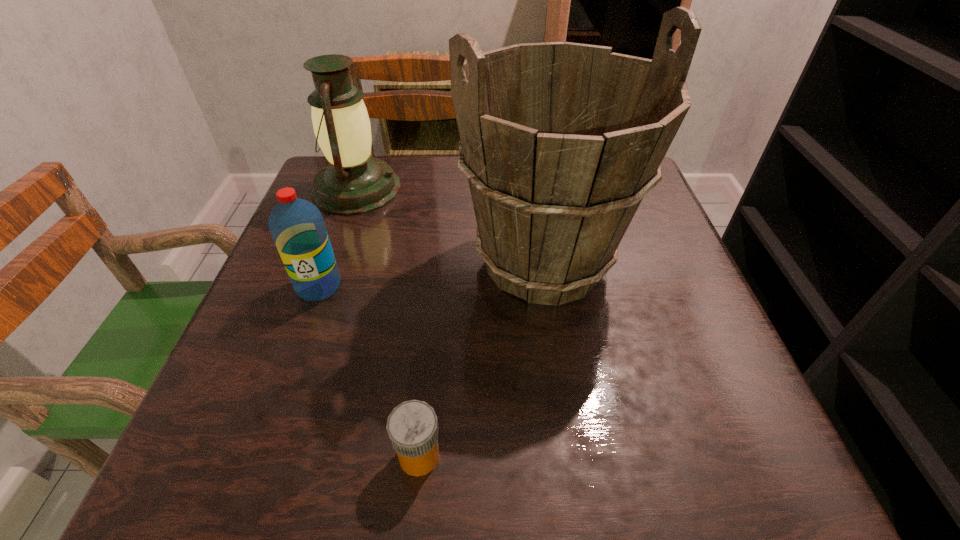
Find the location of `object at the far edge`. object at the far edge is located at coordinates (353, 182).

Find the location of a particular element. Image resolution: width=960 pixels, height=540 pixels. object at the near edge is located at coordinates (412, 426).

What are the coordinates of `lantern that is at the left edge` in the screenshot? It's located at (353, 182).

Locate an element on the screen. This screenshot has width=960, height=540. water bottle that is at the left edge is located at coordinates (297, 226).

Find the location of a particular element. The width and height of the screenshot is (960, 540). object situated at the right edge is located at coordinates (560, 142).

Where is `object that is at the far left corner`? object that is at the far left corner is located at coordinates (353, 182).

Image resolution: width=960 pixels, height=540 pixels. I want to click on blank space at the far edge, so coord(434,160).

In the image, there is a desktop. Where is `free space at the near edge`? This screenshot has height=540, width=960. free space at the near edge is located at coordinates (551, 429).

Identify the location of vacant area at the left edge of the desktop. click(x=363, y=226).

In the image, there is a desktop. Where is `vacant space at the right edge`? The width and height of the screenshot is (960, 540). vacant space at the right edge is located at coordinates (650, 234).